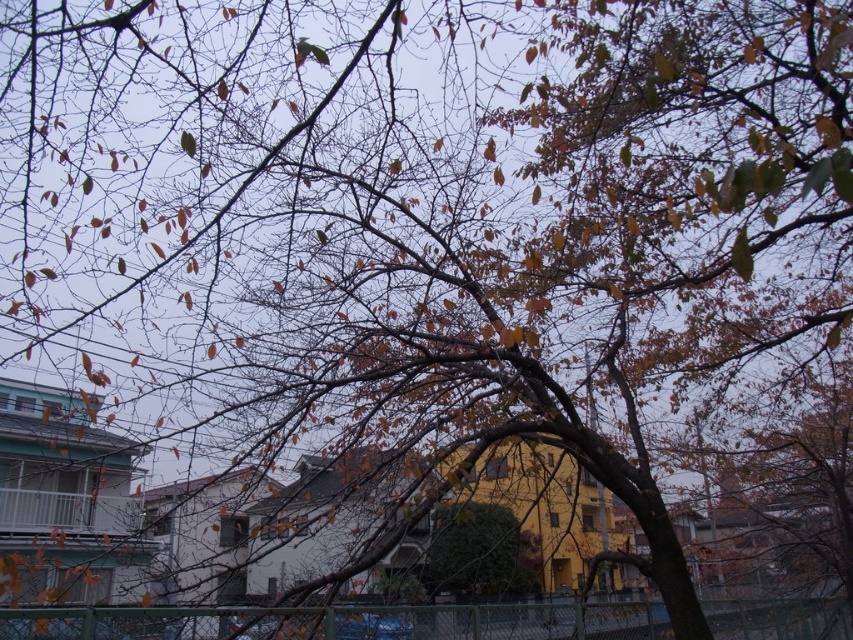
Is green chain-link fence at lower center above green leafy bush at center?

Yes, green chain-link fence at lower center is above green leafy bush at center.

Between point (799, 609) and point (524, 573), which one is positioned in front?

Positioned in front is point (799, 609).

This screenshot has height=640, width=853. What are the coordinates of `green chain-link fence at lower center` in the screenshot? It's located at (345, 621).